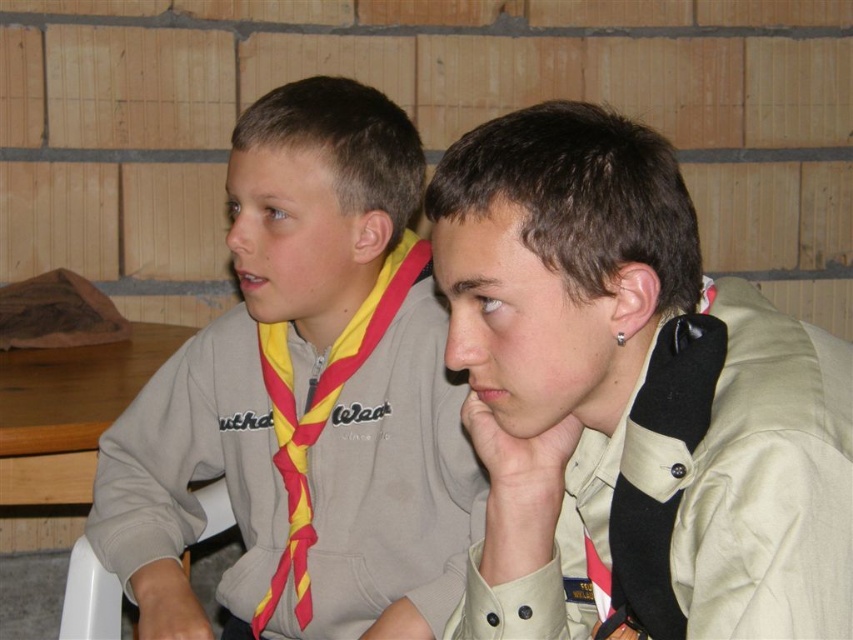
You are a photographer setting up for a group photo. You need to ensure that both the tan uniform shirt at center and the gray fleece sweatshirt at left are fully visible in the frame. Based on their current positions, is there any part of either clothing item that might be obscured?

The tan uniform shirt at center is in front of the gray fleece sweatshirt at left, so parts of the gray fleece sweatshirt at left could be obscured by the tan uniform shirt at center. The tan uniform shirt at center should be moved back or the gray fleece sweatshirt at left moved forward to ensure both are fully visible.